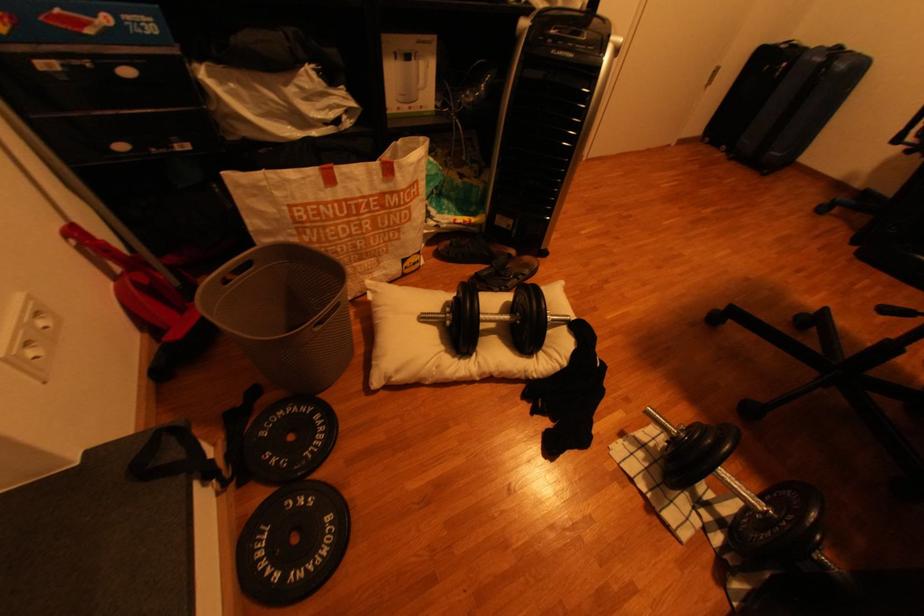
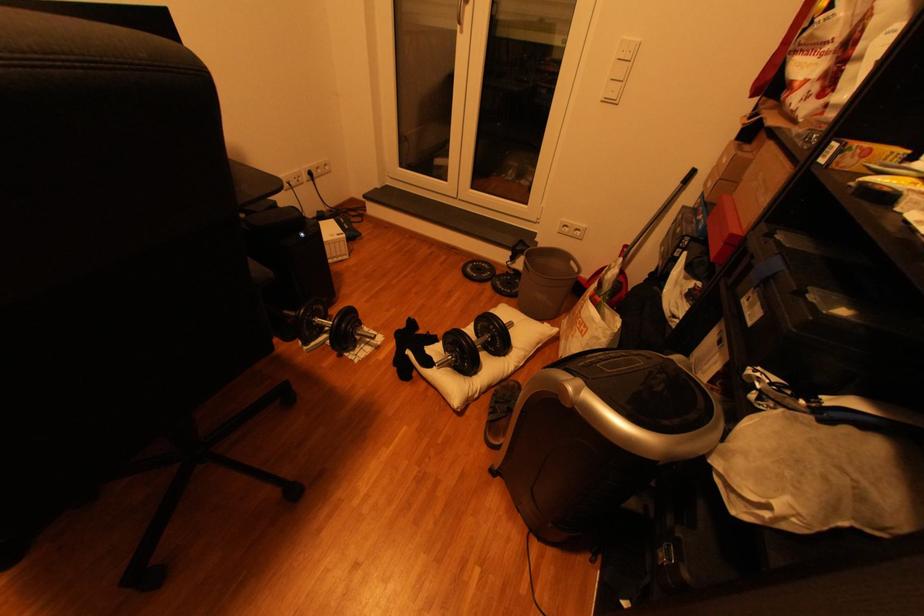
Find the pixel in the second image that matches the point at 574,328 in the first image.

(445, 361)